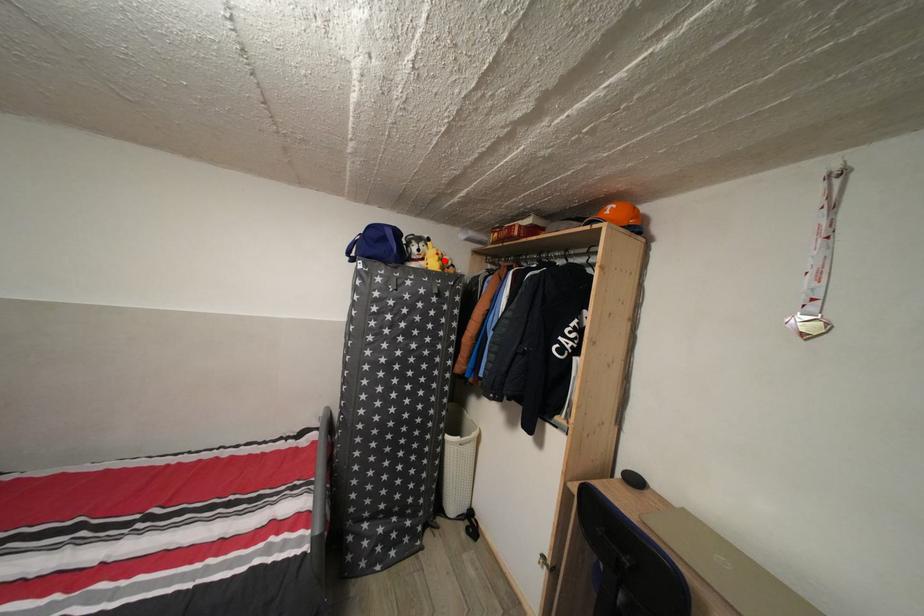
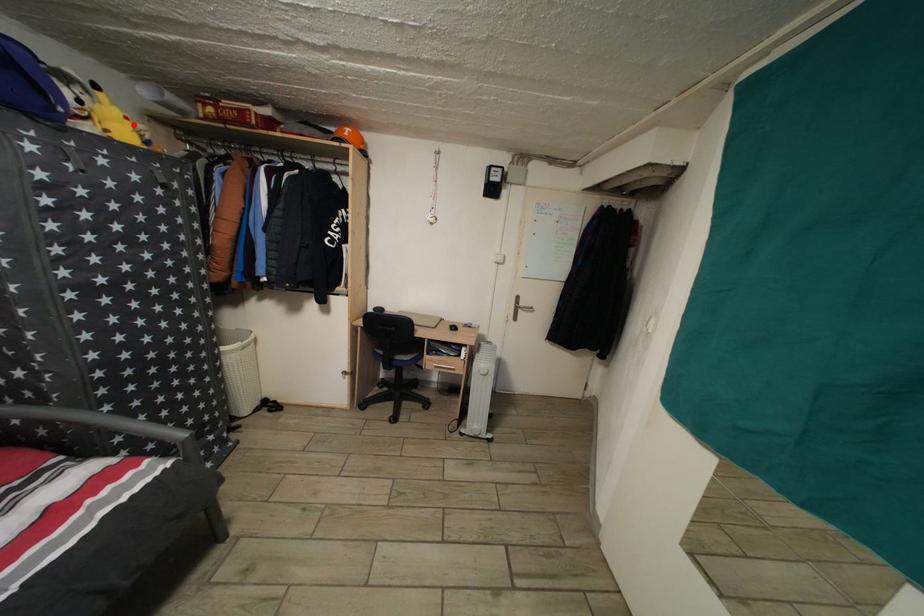
I am providing you with two images of the same scene from different viewpoints. A red point is marked on the first image and another point is marked on the second image. Is the marked point in image1 the same physical position as the marked point in image2?

Yes